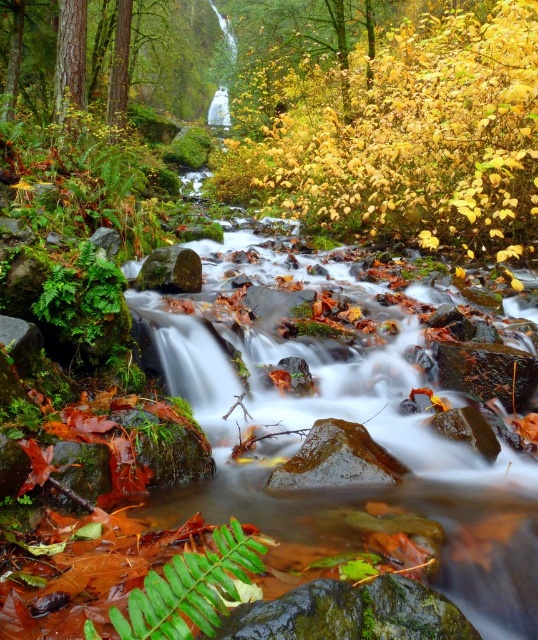
Question: Which object is the farthest from the smooth bark tree at upper left?

Choices:
 (A) green matte fern at lower left
 (B) green mossy rock at center

Answer: (A)

Question: Considering the relative positions of smooth bark tree at upper left and green mossy rock at center in the image provided, where is smooth bark tree at upper left located with respect to green mossy rock at center?

Choices:
 (A) left
 (B) right

Answer: (A)

Question: Which object is positioned closest to the smooth bark tree at upper left?

Choices:
 (A) green mossy rock at center
 (B) green matte fern at lower left

Answer: (A)

Question: In this image, where is green matte fern at lower left located relative to green mossy rock at center?

Choices:
 (A) above
 (B) below

Answer: (B)

Question: Is smooth bark tree at upper left wider than green matte fern at lower left?

Choices:
 (A) no
 (B) yes

Answer: (B)

Question: Which of the following is the closest to the observer?

Choices:
 (A) (x=4, y=113)
 (B) (x=160, y=280)
 (C) (x=243, y=561)

Answer: (C)